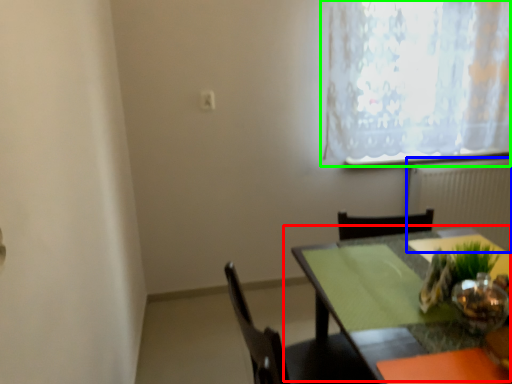
Question: Considering the real-world distances, which object is closest to table (highlighted by a red box)? radiator (highlighted by a blue box) or window (highlighted by a green box).

Choices:
 (A) radiator
 (B) window

Answer: (B)